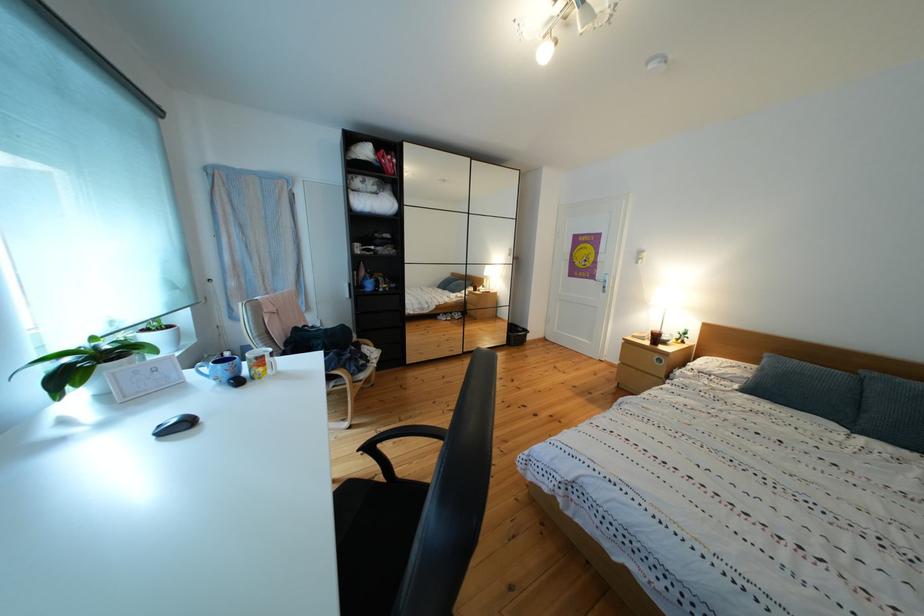
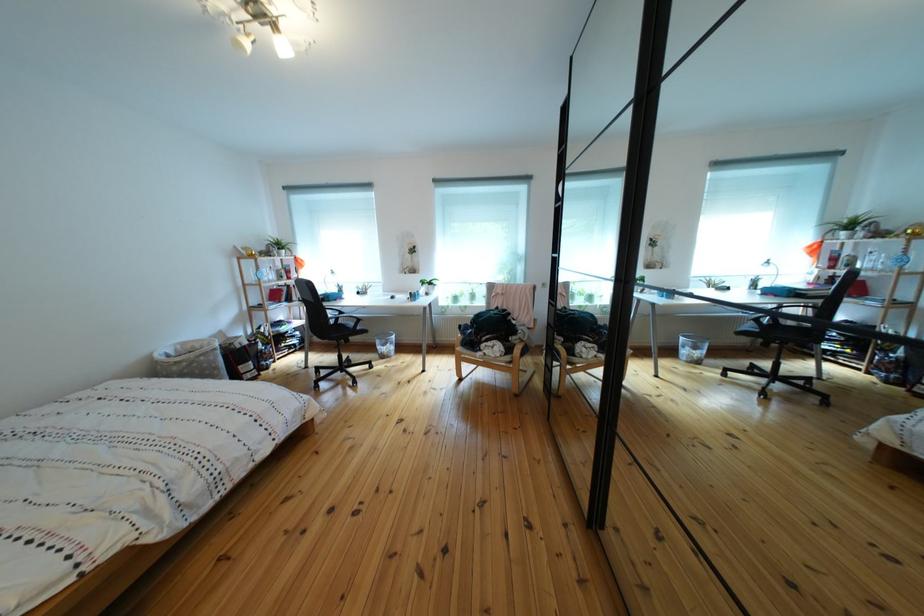
Question: I am providing you with two images of the same scene from different viewpoints. After the viewpoint changes to image2, which objects are now occluded?

Choices:
 (A) multicolored mug handle
 (B) glass blender pitcher handle
 (C) black chair armrest
 (D) white desk lamp

Answer: (A)